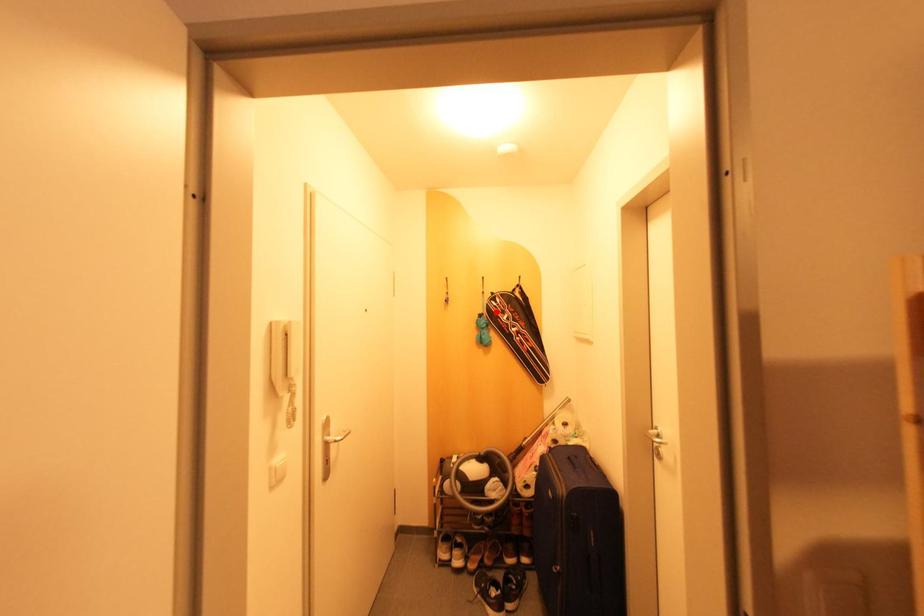
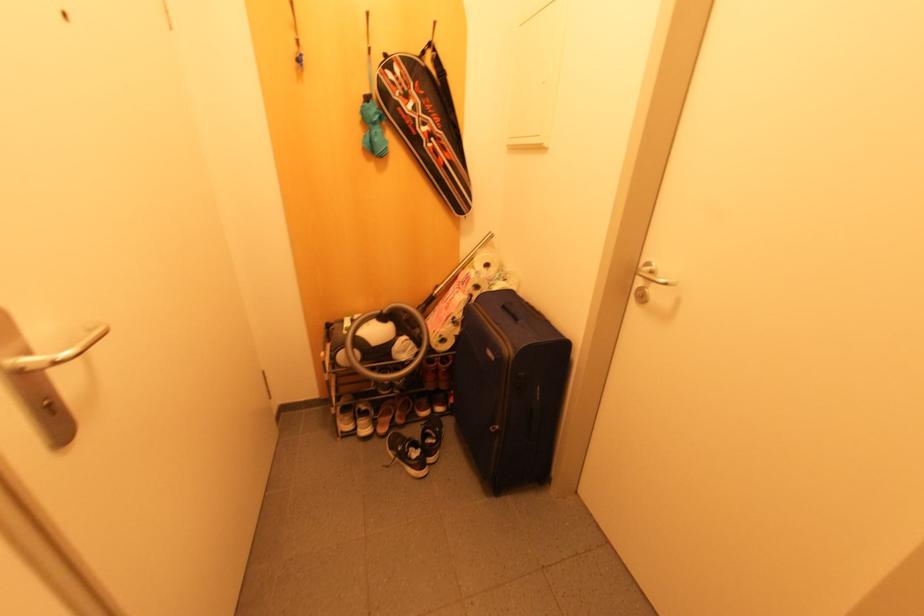
In the second image, find the point that corresponds to the highlighted location in the first image.

(395, 94)